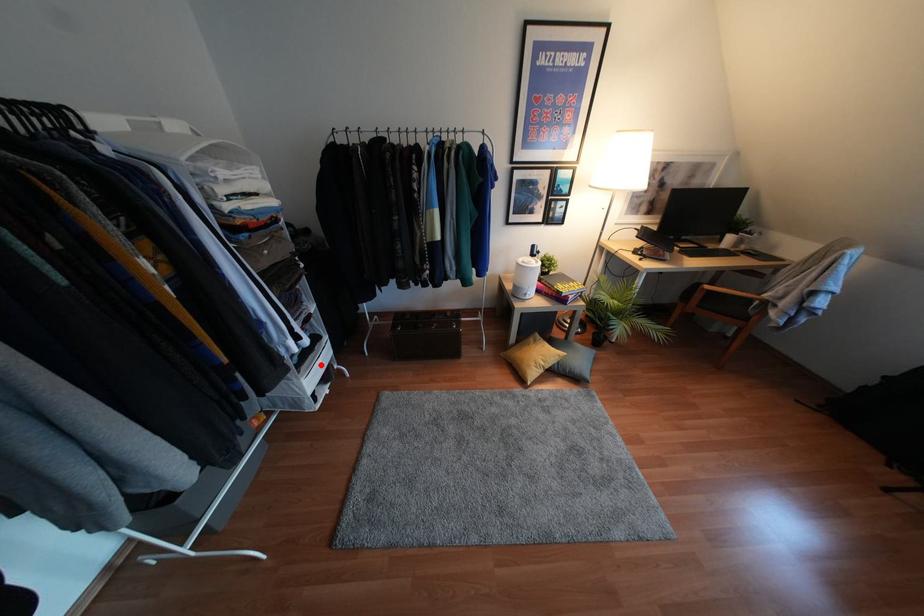
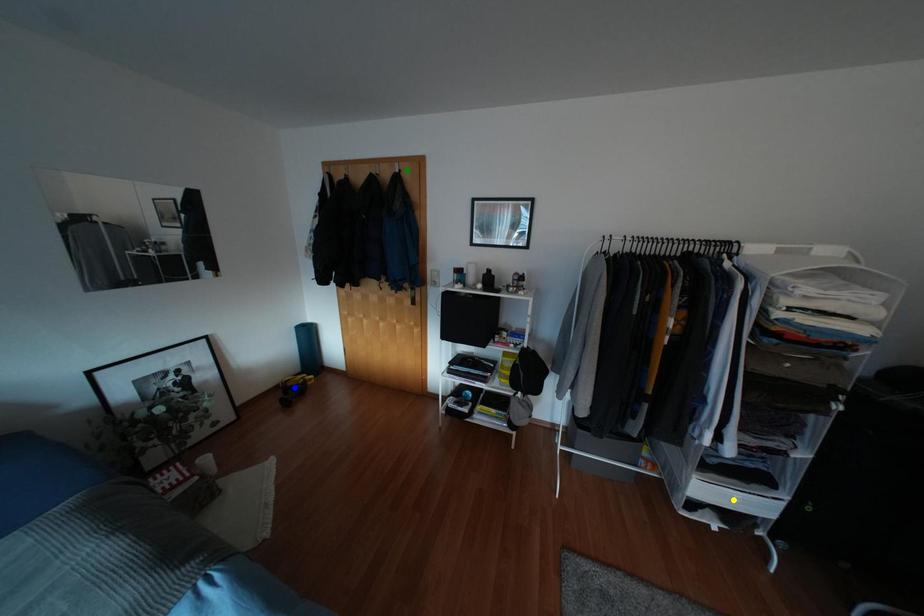
Question: I am providing you with two images of the same scene from different viewpoints. A red point is marked on the first image. You are given multiple points on the second image. Which spot in image 2 lines up with the point in image 1?

Choices:
 (A) yellow point
 (B) green point
 (C) blue point

Answer: (A)